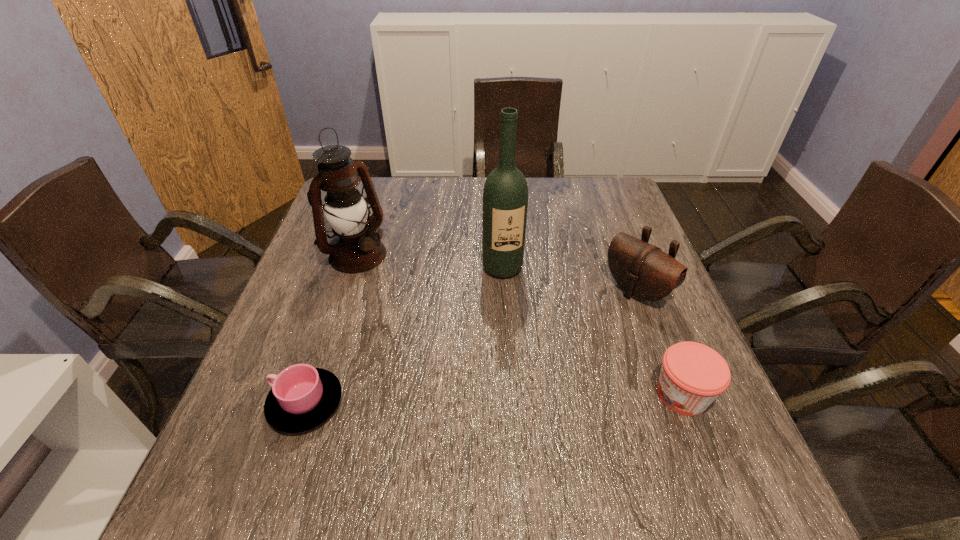
Find the location of a particular element. cup is located at coordinates pyautogui.click(x=302, y=397).

Image resolution: width=960 pixels, height=540 pixels. Find the location of `the second shortest object`. the second shortest object is located at coordinates (693, 375).

The image size is (960, 540). I want to click on the second tallest object, so click(x=356, y=247).

At what (x,y) coordinates should I click in order to perform the action: click on the third object from right to left. Please return your answer as a coordinate pair (x, y). Looking at the image, I should click on (505, 196).

Image resolution: width=960 pixels, height=540 pixels. I want to click on pouch, so click(643, 271).

Find the location of `vacant space located 0.330m on the front label of the jam`. vacant space located 0.330m on the front label of the jam is located at coordinates (483, 395).

This screenshot has width=960, height=540. Identify the location of vacant space located on the front label of the jam. (524, 395).

Locate an element on the screen. blank space located 0.140m on the front label of the jam is located at coordinates (581, 395).

The image size is (960, 540). Identify the location of free location located 0.250m on the side of the fourth shortest object, there is a wick adjustment knob. (440, 316).

The width and height of the screenshot is (960, 540). Identify the location of vacant area located 0.070m on the side of the fourth shortest object, there is a wick adjustment knob. click(x=392, y=280).